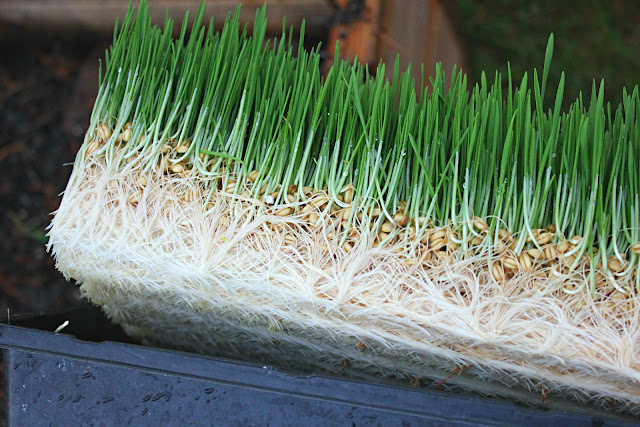
Locate an element on the screen. The image size is (640, 427). empty space inside is located at coordinates (99, 328).